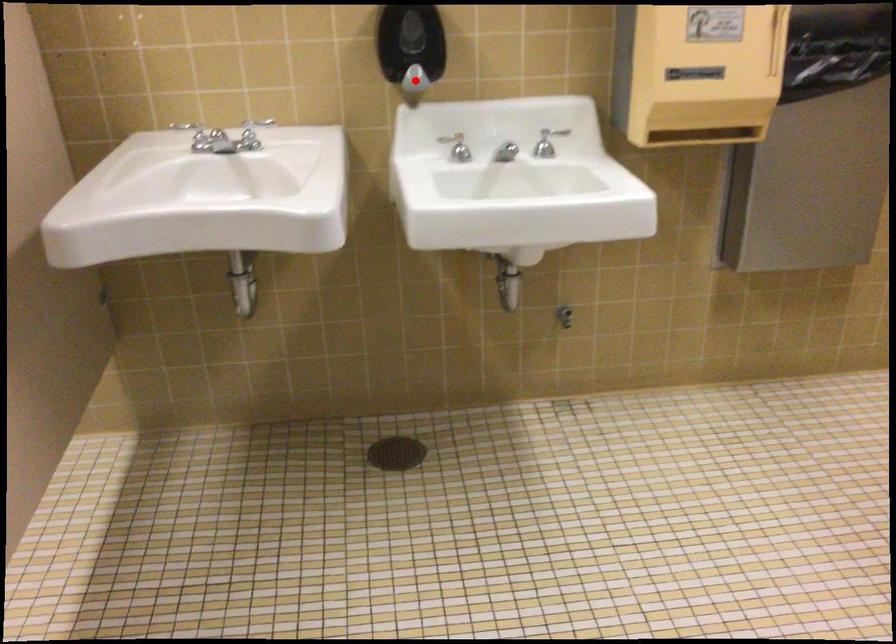
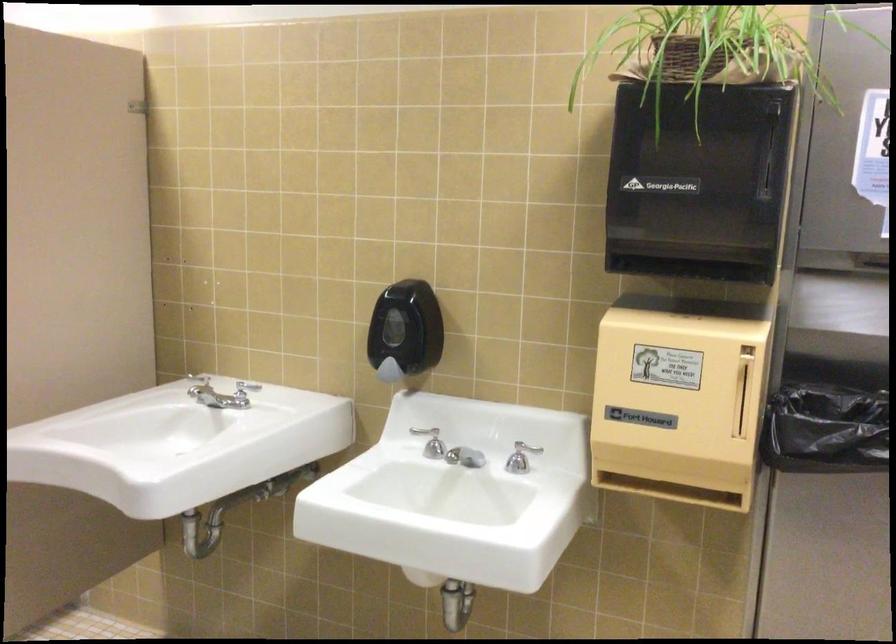
In the second image, find the point that corresponds to the highlighted location in the first image.

(389, 371)